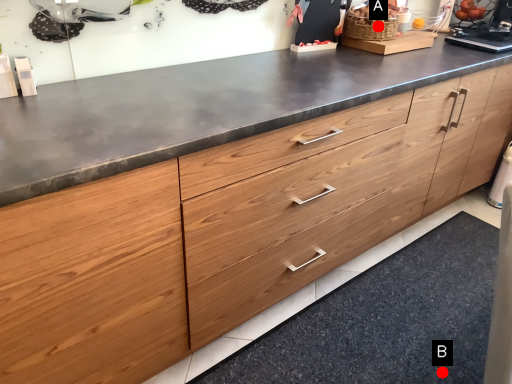
Question: Two points are circled on the image, labeled by A and B beside each circle. Which point appears farthest from the camera in this image?

Choices:
 (A) A is further
 (B) B is further

Answer: (A)